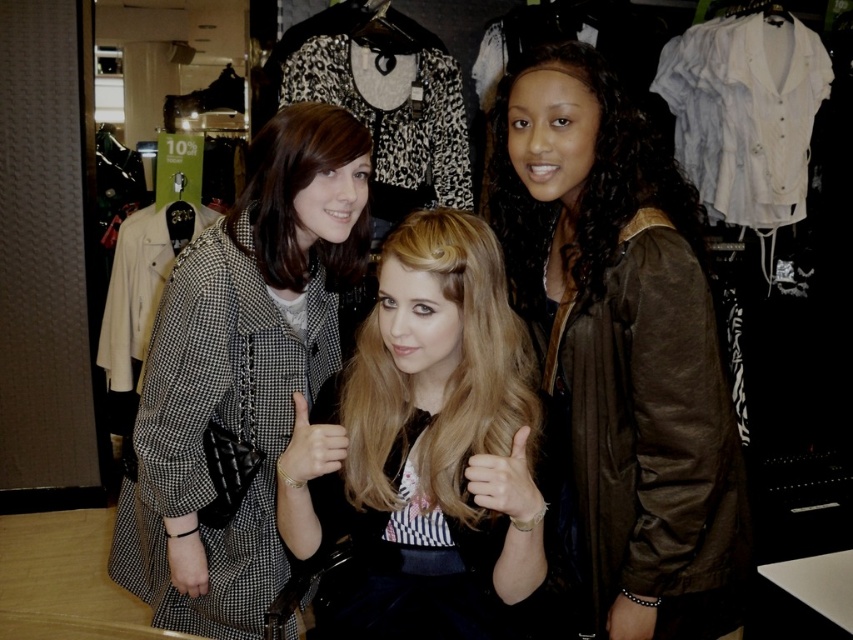
Based on the scene description, where is the checkered fabric coat at center located in terms of its 2D coordinates?

The checkered fabric coat at center is located at the 2D coordinates of point (x=241, y=374).

You are a fashion designer who wants to place a new accessory between the checkered fabric coat at center and the black leather bracelet at lower right. Considering the distance between them, can you estimate if the accessory will fit without overlapping either item?

The checkered fabric coat at center and black leather bracelet at lower right are 32.31 inches apart from each other. Since the accessory needs space to fit between them, the 32.31 inches distance should be sufficient as long as the accessory is smaller than that distance.

You are a fashion designer observing the three people in the clothing store. You notice the checkered fabric coat at center and the gold metallic bracelet at center. How far apart are these two items?

The checkered fabric coat at center is 45.84 centimeters from the gold metallic bracelet at center.